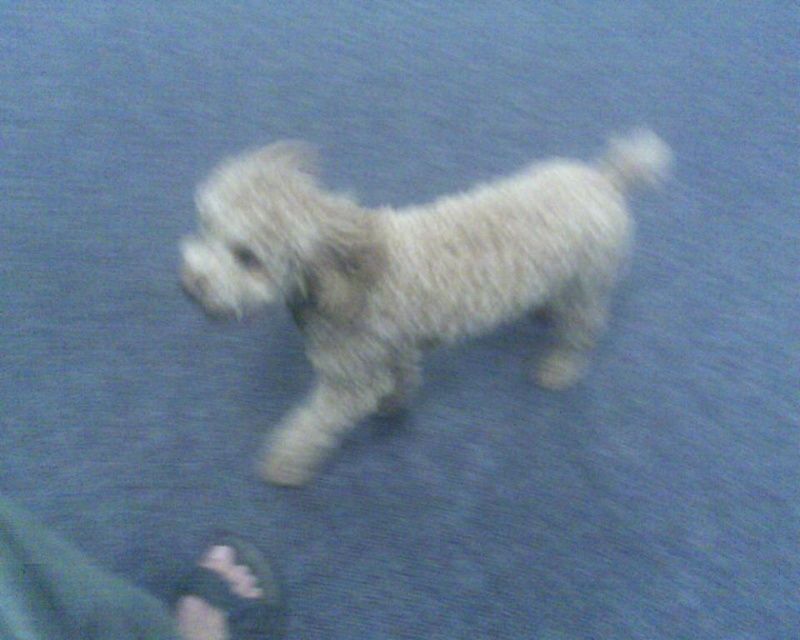
Is point (220, 291) farther from camera compared to point (210, 611)?

No, it is in front of (210, 611).

In order to click on white fluffy dog at center in this screenshot , I will do `click(408, 273)`.

The image size is (800, 640). I want to click on white fluffy dog at center, so [x=408, y=273].

Can you confirm if white fluffy dog at center is positioned to the left of black fabric sandal at lower left?

Incorrect, white fluffy dog at center is not on the left side of black fabric sandal at lower left.

Who is shorter, white fluffy dog at center or black fabric sandal at lower left?

Standing shorter between the two is black fabric sandal at lower left.

Does point (318, 458) lie in front of point (224, 577)?

No, (318, 458) is behind (224, 577).

Find the location of a particular element. white fluffy dog at center is located at coordinates pyautogui.click(x=408, y=273).

Is green fabric pants at lower left closer to camera compared to black fabric sandal at lower left?

Yes, it is in front of black fabric sandal at lower left.

Is green fabric pants at lower left thinner than black fabric sandal at lower left?

Correct, green fabric pants at lower left's width is less than black fabric sandal at lower left's.

This screenshot has height=640, width=800. Identify the location of green fabric pants at lower left. (126, 593).